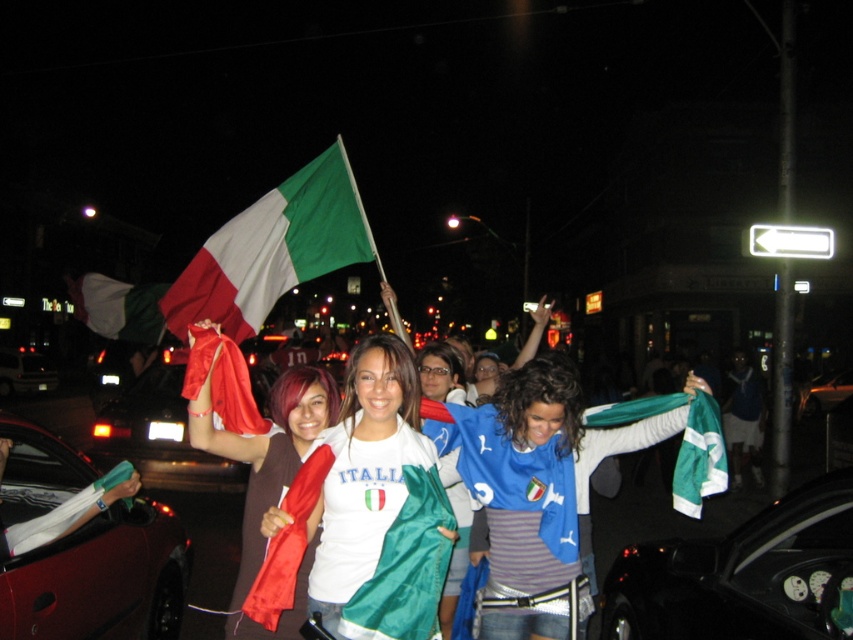
Is green-white-red fabric flag at center smaller than metallic silver car at lower right?

Yes.

Between point (137, 291) and point (807, 410), which one is positioned in front?

Point (137, 291) is more forward.

At what (x,y) coordinates should I click in order to perform the action: click on green-white-red fabric flag at center. Please return your answer as a coordinate pair (x, y). The image size is (853, 640). Looking at the image, I should click on (119, 307).

Between blue jersey at center and metallic red car at lower left, which one has more height?

blue jersey at center

Where is `blue jersey at center`? This screenshot has height=640, width=853. blue jersey at center is located at coordinates (532, 468).

Identify the location of blue jersey at center. (532, 468).

Which is behind, point (323, 522) or point (22, 388)?

The point (22, 388) is behind.

Does point (367, 504) come farther from viewer compared to point (6, 385)?

No, (367, 504) is closer to viewer.

Where is `white matte shirt at center`? Image resolution: width=853 pixels, height=640 pixels. white matte shirt at center is located at coordinates (358, 476).